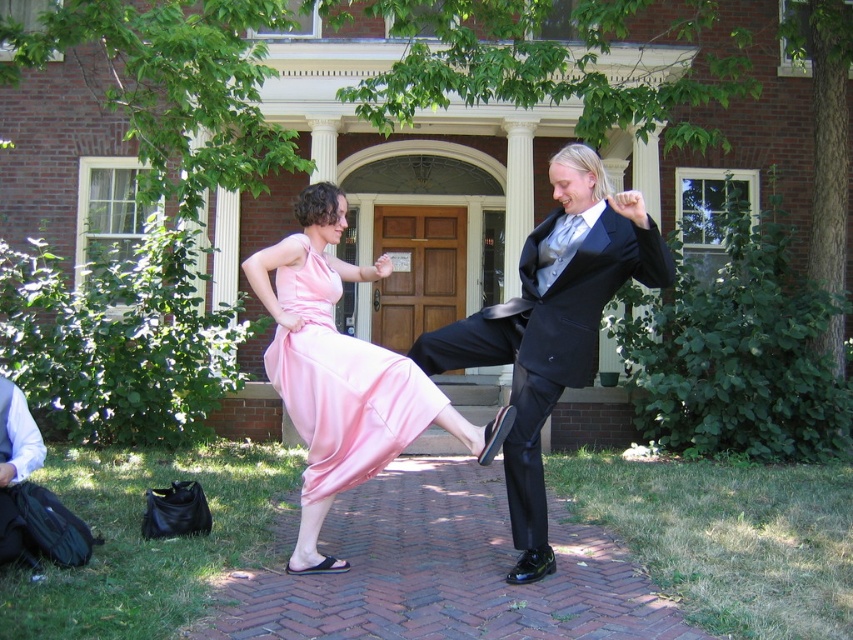
You are a photographer positioned to the left of the scene. You want to capture a photo where both the shiny black suit at center and the satin pink dress at center are visible. Which direction should you move to ensure both subjects are in frame?

Since the shiny black suit at center is to the right of the satin pink dress at center, you should move to the left to ensure both subjects are in frame. This adjustment will allow the photographer to capture both the shiny black suit at center and the satin pink dress at center within the camera view.

From the picture: You are a photographer standing 10 feet away from the shiny black suit at center and the satin pink dress at center. You want to capture a photo where both subjects are in focus. Given that your camera has a depth of field that can sharply focus objects within a 30 inch range, will both subjects be in focus?

The shiny black suit at center is 29.35 inches away from the satin pink dress at center. Since the distance between them is within the camera lens depth of field range of 30 inches, both subjects will be in focus.

You are a photographer standing in front of the brick building. You see the shiny black suit at center and the pink satin dress at center. Which one do you need to adjust your camera focus on first if you want to capture both clearly?

The shiny black suit at center is larger in size than the pink satin dress at center, so you should focus on the shiny black suit at center first to ensure both are in focus.